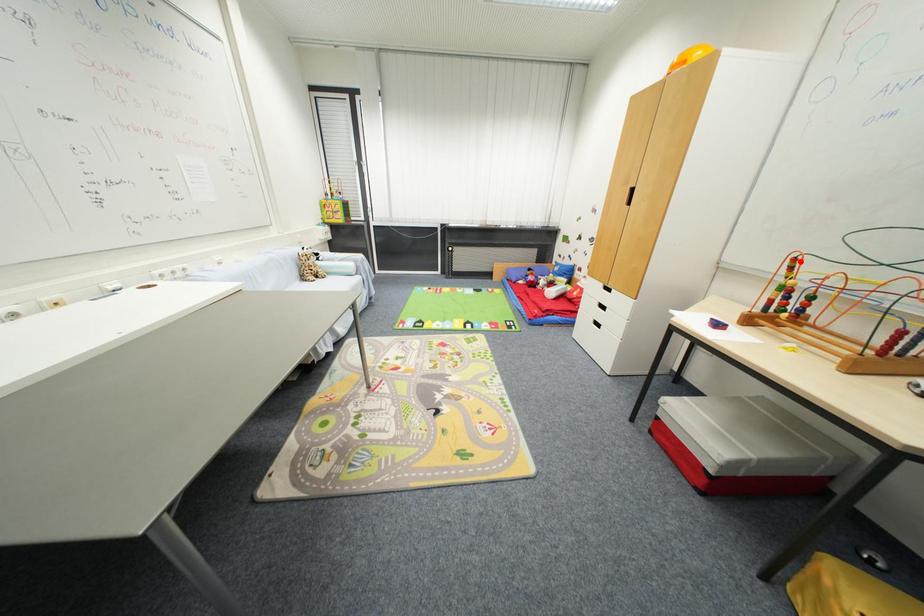
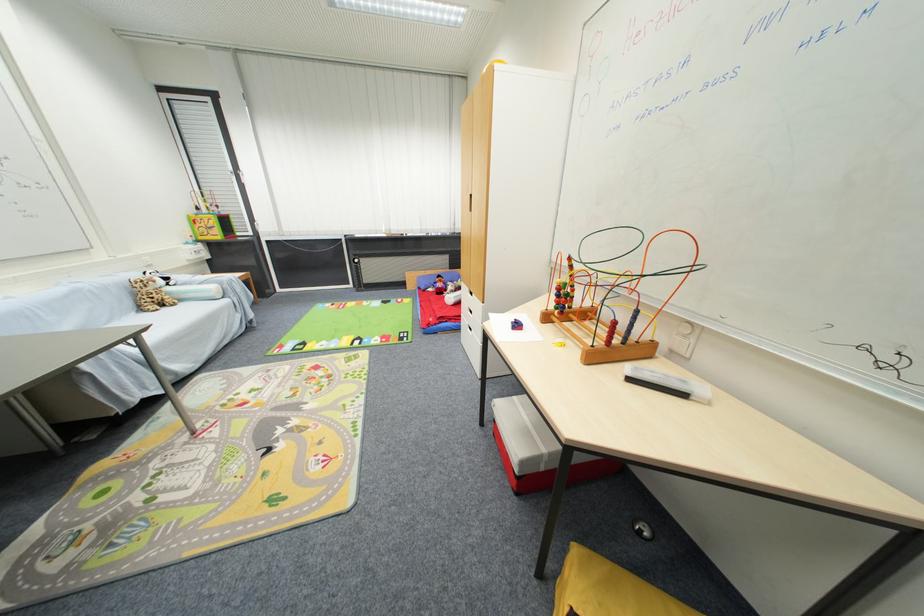
Question: I am providing you with two images of the same scene from different viewpoints. A red point is shown in image1. For the corresponding object point in image2, is it positioned nearer or farther from the camera?

Choices:
 (A) Nearer
 (B) Farther

Answer: (A)